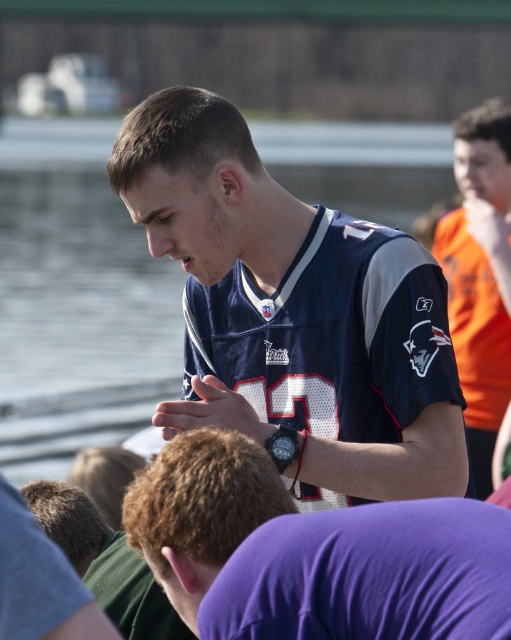
Who is positioned more to the right, blue jersey at center or green jersey at center?

blue jersey at center

From the picture: Does blue jersey at center have a larger size compared to green jersey at center?

Indeed, blue jersey at center has a larger size compared to green jersey at center.

Locate an element on the screen. The height and width of the screenshot is (640, 511). blue jersey at center is located at coordinates (479, 275).

Where is `blue jersey at center`? blue jersey at center is located at coordinates click(479, 275).

Between navy blue jersey at center and matte jersey at center, which one has more height?

matte jersey at center is taller.

Does navy blue jersey at center have a smaller size compared to matte jersey at center?

Indeed, navy blue jersey at center has a smaller size compared to matte jersey at center.

What are the coordinates of `navy blue jersey at center` in the screenshot? It's located at (294, 314).

Is point (272, 532) closer to camera compared to point (148, 611)?

Yes, point (272, 532) is closer to viewer.

Can you confirm if matte jersey at center is positioned to the right of green jersey at center?

Correct, you'll find matte jersey at center to the right of green jersey at center.

Is point (267, 472) behind point (182, 637)?

No, it is not.

What are the coordinates of `matte jersey at center` in the screenshot? It's located at (312, 554).